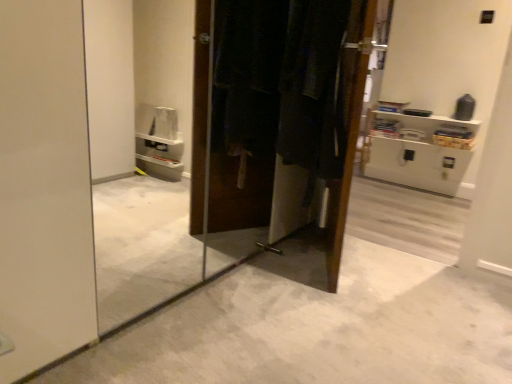
This screenshot has width=512, height=384. Describe the element at coordinates (424, 129) in the screenshot. I see `white plastic shelf at upper right` at that location.

Locate an element on the screen. The height and width of the screenshot is (384, 512). white plastic shelf at upper right is located at coordinates [x=424, y=129].

In order to face white plastic shelf at upper right, should I rotate leftwards or rightwards?

You should rotate right by 21.307 degrees.

The width and height of the screenshot is (512, 384). What do you see at coordinates (281, 80) in the screenshot?
I see `dark fabric laundry at center` at bounding box center [281, 80].

Where is `dark fabric laundry at center`? dark fabric laundry at center is located at coordinates (281, 80).

Image resolution: width=512 pixels, height=384 pixels. In order to click on white plastic shelf at upper right in this screenshot , I will do `click(424, 129)`.

Between dark fabric laundry at center and white plastic shelf at upper right, which one appears on the left side from the viewer's perspective?

dark fabric laundry at center is more to the left.

Is dark fabric laundry at center in front of white plastic shelf at upper right?

Yes, dark fabric laundry at center is closer to the viewer.

Does point (316, 74) come farther from viewer compared to point (468, 130)?

No, (316, 74) is in front of (468, 130).

Looking at this image, from the image's perspective, is dark fabric laundry at center above white plastic shelf at upper right?

No.

From a real-world perspective, between dark fabric laundry at center and white plastic shelf at upper right, who is vertically higher?

dark fabric laundry at center is physically above.

Which object is wider, dark fabric laundry at center or white plastic shelf at upper right?

dark fabric laundry at center.

Who is shorter, dark fabric laundry at center or white plastic shelf at upper right?

With less height is white plastic shelf at upper right.

Which of these two, dark fabric laundry at center or white plastic shelf at upper right, is smaller?

white plastic shelf at upper right.

Is dark fabric laundry at center located outside white plastic shelf at upper right?

Yes, dark fabric laundry at center is not within white plastic shelf at upper right.

Are dark fabric laundry at center and white plastic shelf at upper right far apart?

Yes.

Is dark fabric laundry at center oriented towards white plastic shelf at upper right?

No, dark fabric laundry at center is not oriented towards white plastic shelf at upper right.

Looking at this image, can you tell me how much dark fabric laundry at center and white plastic shelf at upper right differ in facing direction?

25.9 degrees.

Identify the location of laundry on the left of white plastic shelf at upper right. The height and width of the screenshot is (384, 512). (281, 80).

Can you confirm if white plastic shelf at upper right is positioned to the left of dark fabric laundry at center?

No, white plastic shelf at upper right is not to the left of dark fabric laundry at center.

Does white plastic shelf at upper right come behind dark fabric laundry at center?

Yes, the depth of white plastic shelf at upper right is greater than that of dark fabric laundry at center.

Which is closer to the camera, (375,128) or (273,15)?

The point (273,15) is in front.

From the image's perspective, is white plastic shelf at upper right located above dark fabric laundry at center?

Yes.

From a real-world perspective, who is located higher, white plastic shelf at upper right or dark fabric laundry at center?

From a 3D spatial view, dark fabric laundry at center is above.

Which object is wider, white plastic shelf at upper right or dark fabric laundry at center?

dark fabric laundry at center is wider.

Does white plastic shelf at upper right have a greater height compared to dark fabric laundry at center?

In fact, white plastic shelf at upper right may be shorter than dark fabric laundry at center.

Which of these two, white plastic shelf at upper right or dark fabric laundry at center, is bigger?

Bigger between the two is dark fabric laundry at center.

Is white plastic shelf at upper right located outside dark fabric laundry at center?

Yes, white plastic shelf at upper right is not within dark fabric laundry at center.

Is white plastic shelf at upper right far away from dark fabric laundry at center?

Yes, white plastic shelf at upper right and dark fabric laundry at center are located far from each other.

Is white plastic shelf at upper right looking in the opposite direction of dark fabric laundry at center?

white plastic shelf at upper right is not turned away from dark fabric laundry at center.

I want to click on laundry that is above the white plastic shelf at upper right (from a real-world perspective), so tap(281, 80).

This screenshot has width=512, height=384. In order to click on laundry lying on the left of white plastic shelf at upper right in this screenshot , I will do `click(281, 80)`.

Find the location of `shelf on the right of dark fabric laundry at center`. shelf on the right of dark fabric laundry at center is located at coordinates (424, 129).